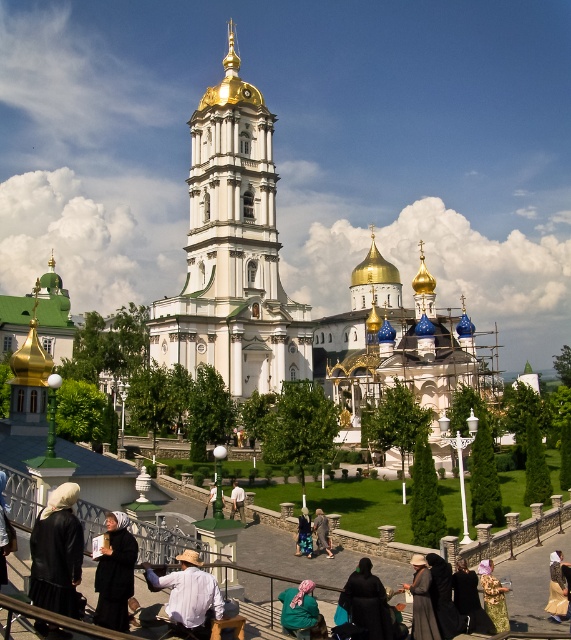
You are a photographer planning to capture the grand architectural complex with the black fabric headscarf at lower left and the pink fabric headscarf at lower center in the foreground. Which headscarf should you focus on if you want to emphasize the wider object in your composition?

The black fabric headscarf at lower left should be focused on because it is wider than the pink fabric headscarf at lower center.

You are a photographer standing in front of the monastery complex. You want to take a photo of the light brown fabric dress at lower right and the light brown leather jacket at center. Which object should you focus on first if you want to capture both clearly in the same frame?

The light brown fabric dress at lower right is in front of the light brown leather jacket at center, so you should focus on the light brown fabric dress at lower right first to ensure both are in focus.